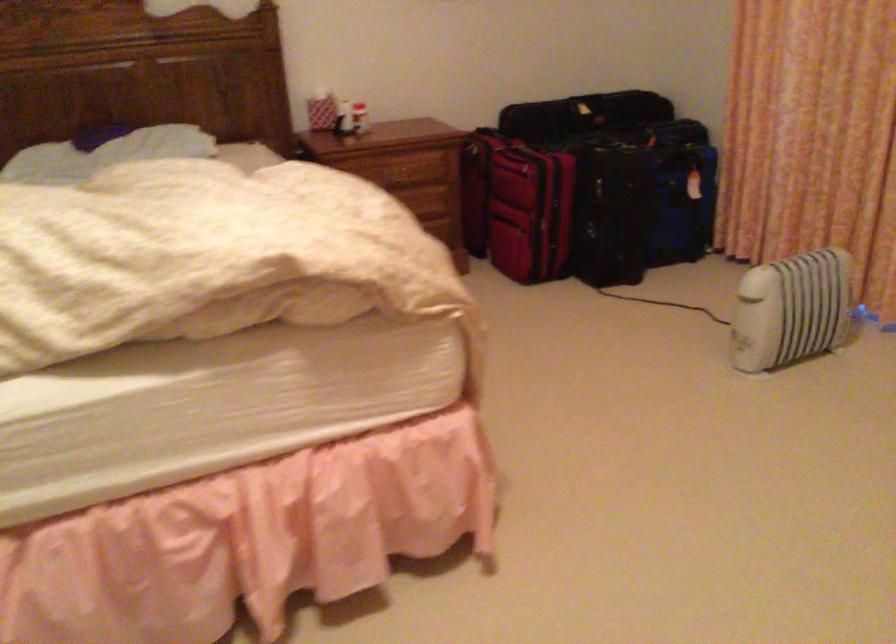
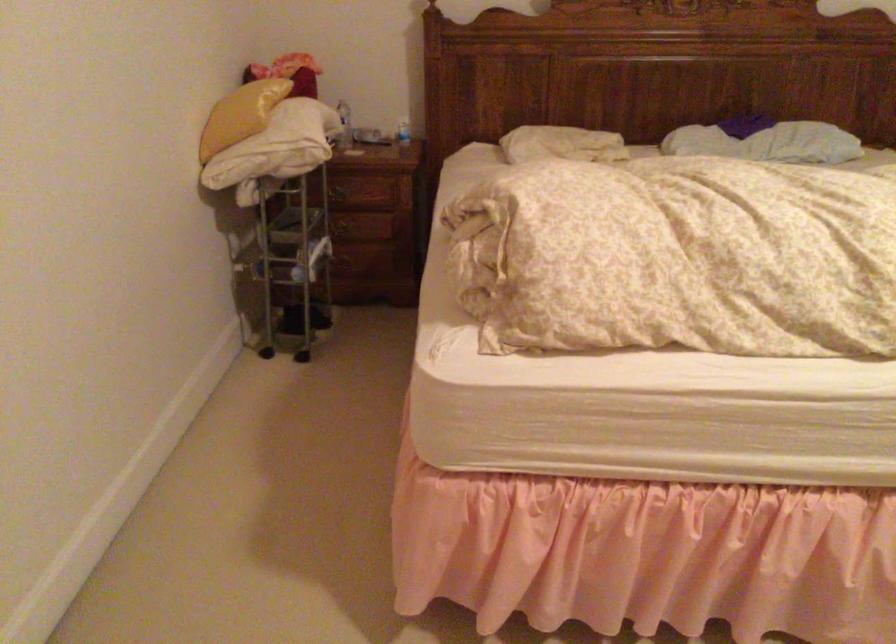
Where in the second image is the point corresponding to pixel 93 158 from the first image?

(767, 142)